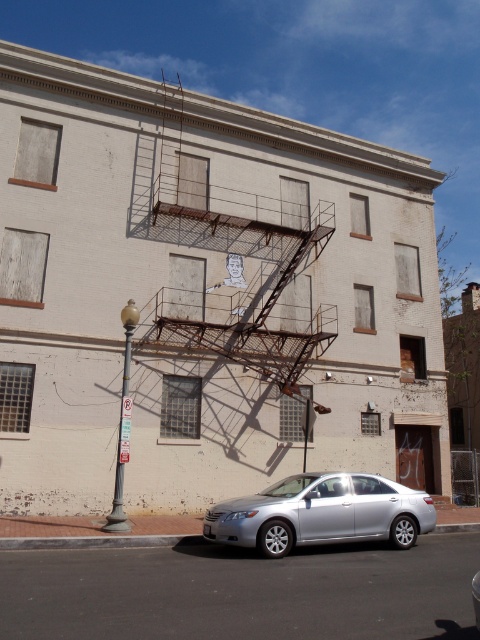
You are standing in front of the building and want to know how far you are from the point marked at coordinates point (155, 342). Can you determine the distance?

→ The point marked at coordinates point (155, 342) is 16.08 meters away from the viewer, so the distance is 16.08 meters.

You are a photographer standing in front of the building. You notice two points marked on the building wall. The first point is at coordinates point [263,522] and the second is at point [130,413]. Which point is closer to your camera?

Point [263,522] is closer to the camera than point [130,413].

You are a window cleaner standing on the ground near the building. You need to clean the rusty metal fire escape at center and the metallic streetlamp at left. Which object should you clean first if you want to start with the one that is higher up?

The rusty metal fire escape at center is located above the metallic streetlamp at left, so you should clean the rusty metal fire escape at center first since it is higher up.